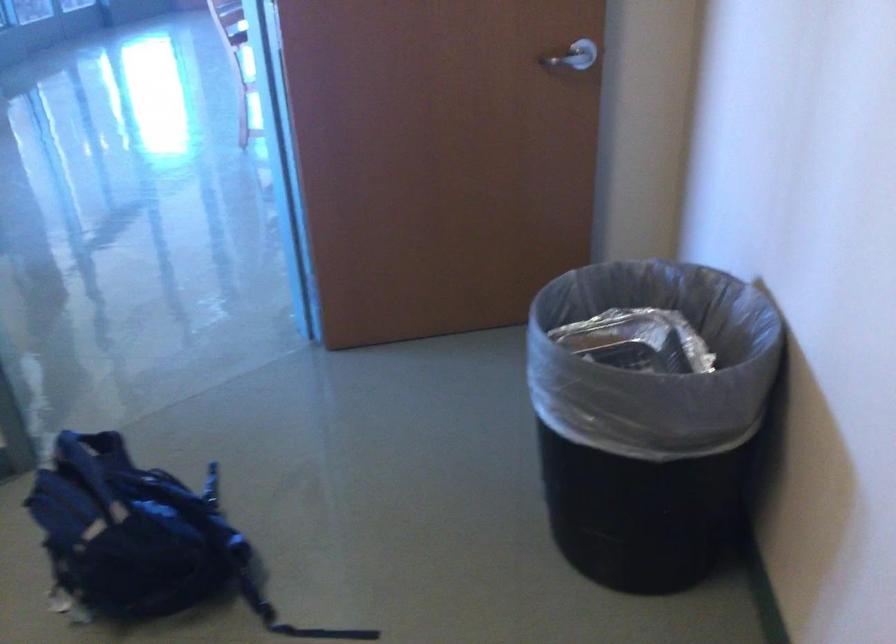
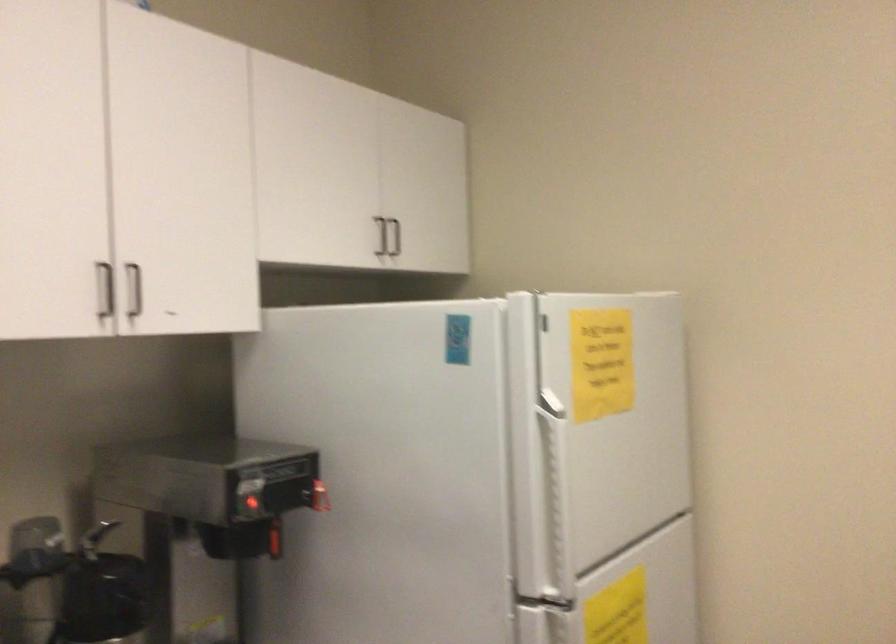
Question: The camera is either moving clockwise (left) or counter-clockwise (right) around the object. The first image is from the beginning of the video and the second image is from the end. Is the camera moving left or right when shooting the video?

Choices:
 (A) Left
 (B) Right

Answer: (B)